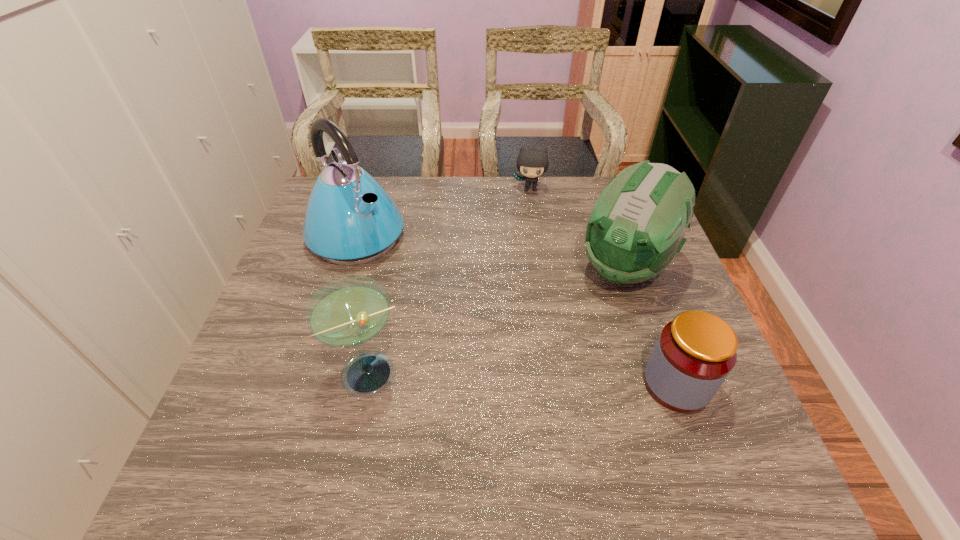
In order to click on the third shortest object in this screenshot , I will do click(x=348, y=312).

Image resolution: width=960 pixels, height=540 pixels. Identify the location of the second shortest object. (694, 354).

Find the location of a particular element. football helmet is located at coordinates (637, 226).

This screenshot has height=540, width=960. What are the coordinates of `the farthest object` in the screenshot? It's located at (532, 163).

The width and height of the screenshot is (960, 540). Find the location of `the shortest object`. the shortest object is located at coordinates (532, 163).

You are a GUI agent. You are given a task and a screenshot of the screen. Output one action in this format:
    pyautogui.click(x=<x>, y=<y>)
    Task: Click on the tallest object
    
    Given the screenshot: What is the action you would take?
    pyautogui.click(x=350, y=219)

The height and width of the screenshot is (540, 960). Find the location of `blank space located 0.080m on the right of the martini`. blank space located 0.080m on the right of the martini is located at coordinates tap(446, 374).

Locate an element on the screen. The width and height of the screenshot is (960, 540). blank space located on the back of the jar is located at coordinates (648, 303).

Locate an element on the screen. vacant point located on the visor of the fourth shortest object is located at coordinates (539, 383).

At what (x,y) coordinates should I click in order to perform the action: click on vacant region located on the visor of the fourth shortest object. Please return your answer as a coordinate pair (x, y). The image size is (960, 540). Looking at the image, I should click on (553, 364).